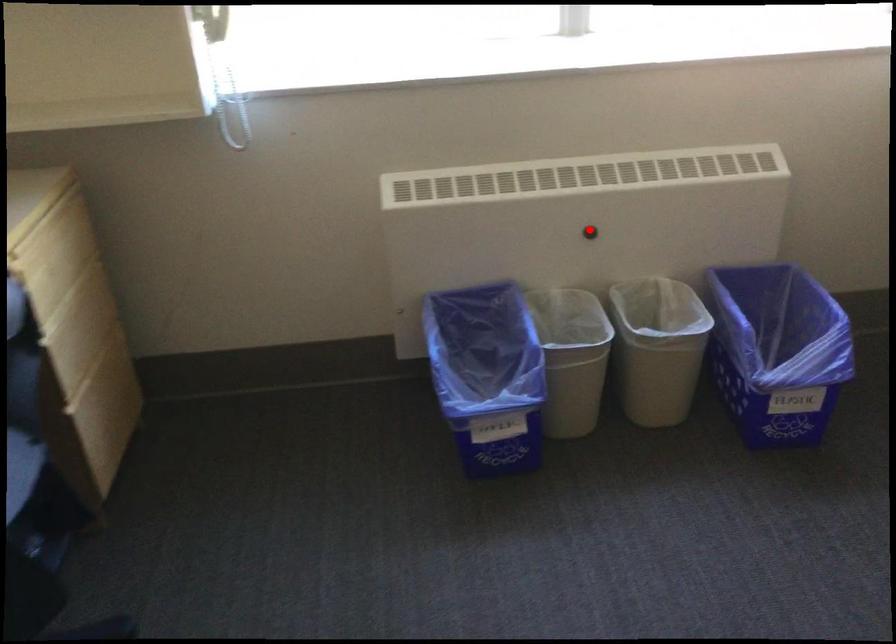
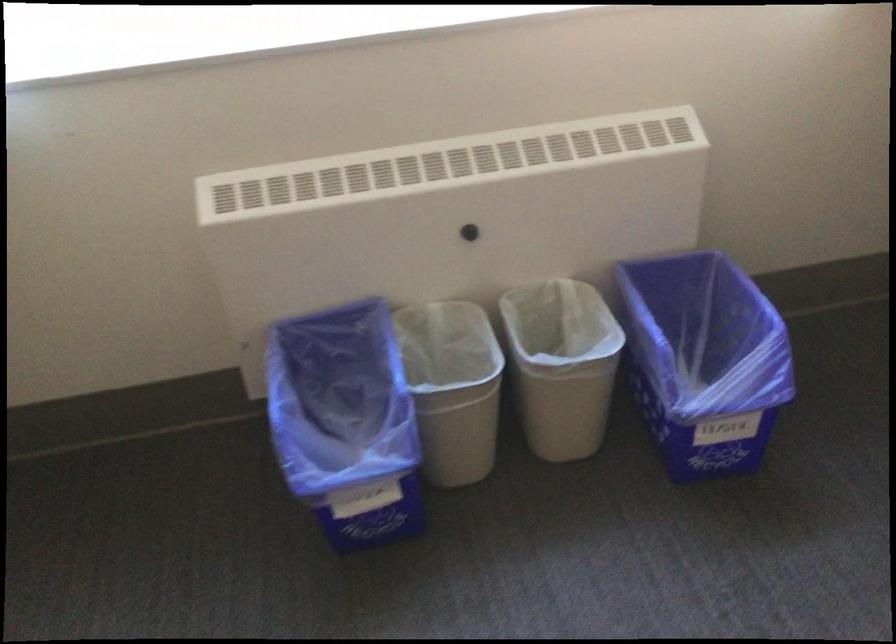
Question: I am providing you with two images of the same scene from different viewpoints. In image1, a red point is highlighted. Considering the same 3D point in image2, which of the following is correct?

Choices:
 (A) It is closer
 (B) It is farther

Answer: (A)